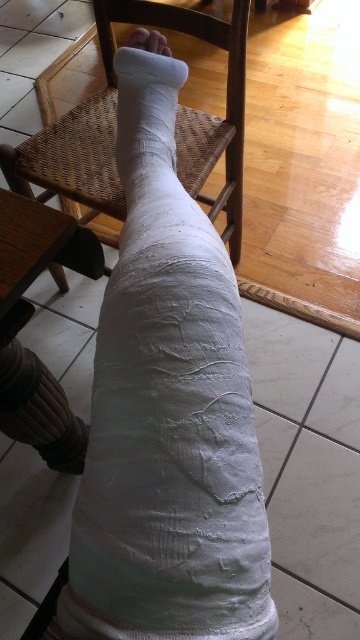
Between white matte plaster bandage at lower center and woven wood chair at center, which one has less height?

woven wood chair at center is shorter.

Is white matte plaster bandage at lower center positioned before woven wood chair at center?

Yes.

Is point (176, 492) farther from camera compared to point (114, 45)?

No.

The width and height of the screenshot is (360, 640). What are the coordinates of `white matte plaster bandage at lower center` in the screenshot? It's located at (167, 410).